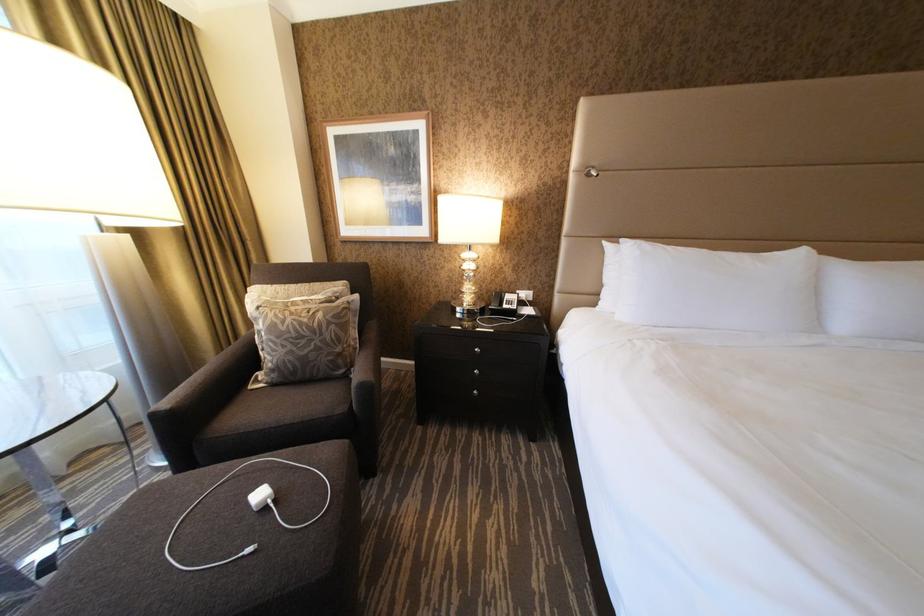
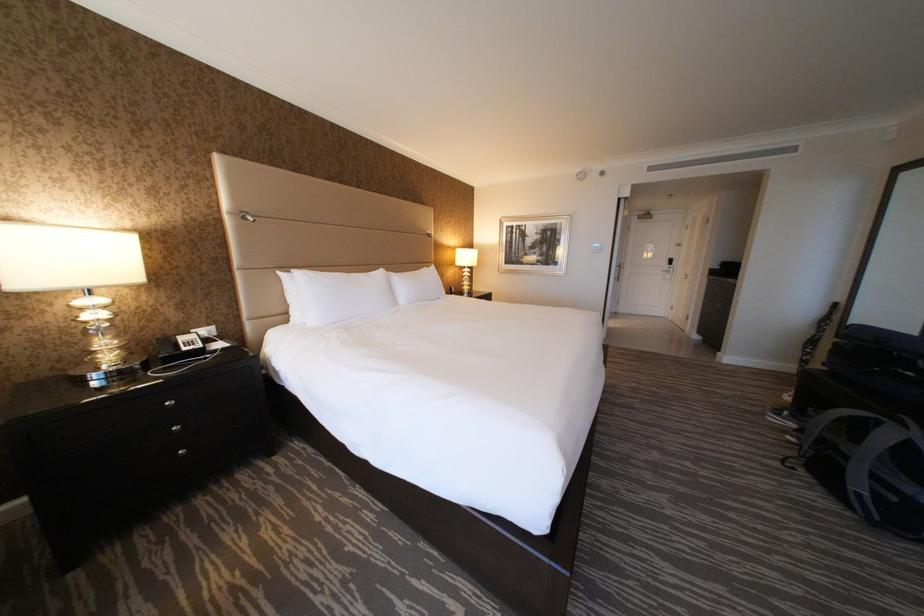
Question: The camera is either moving clockwise (left) or counter-clockwise (right) around the object. The first image is from the beginning of the video and the second image is from the end. Is the camera moving left or right when shooting the video?

Choices:
 (A) Left
 (B) Right

Answer: (A)